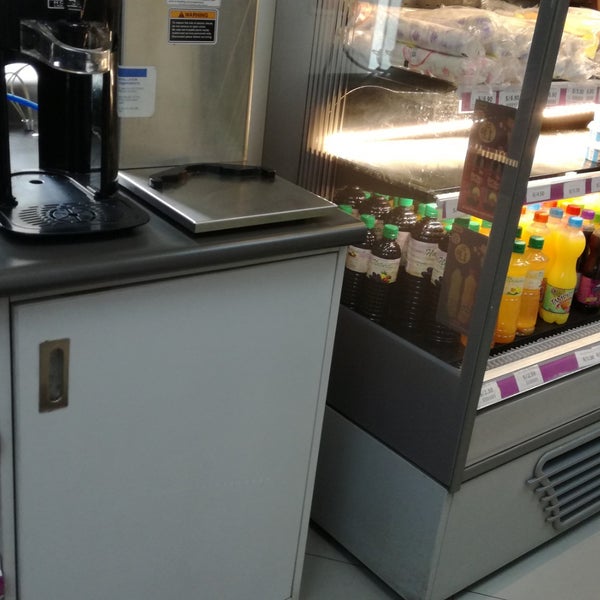
Locate an element on the screen. The width and height of the screenshot is (600, 600). left glass side of refridgerated case is located at coordinates (415, 124).